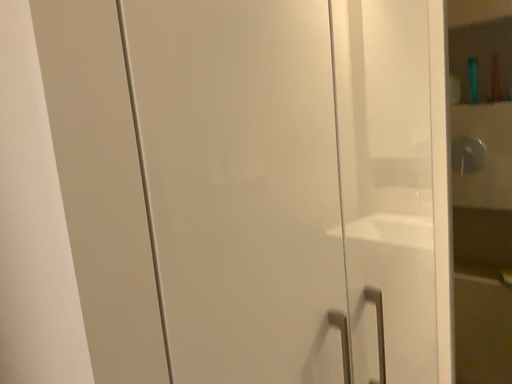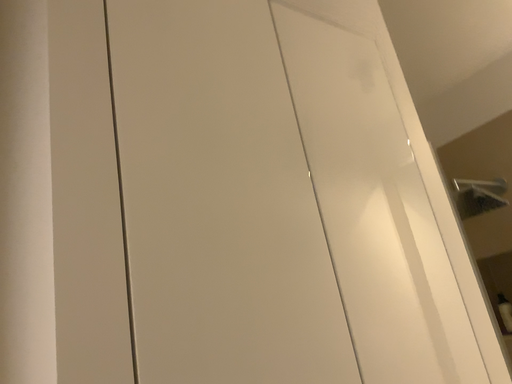
Question: Which way did the camera rotate in the video?

Choices:
 (A) rotated right
 (B) rotated left

Answer: (B)